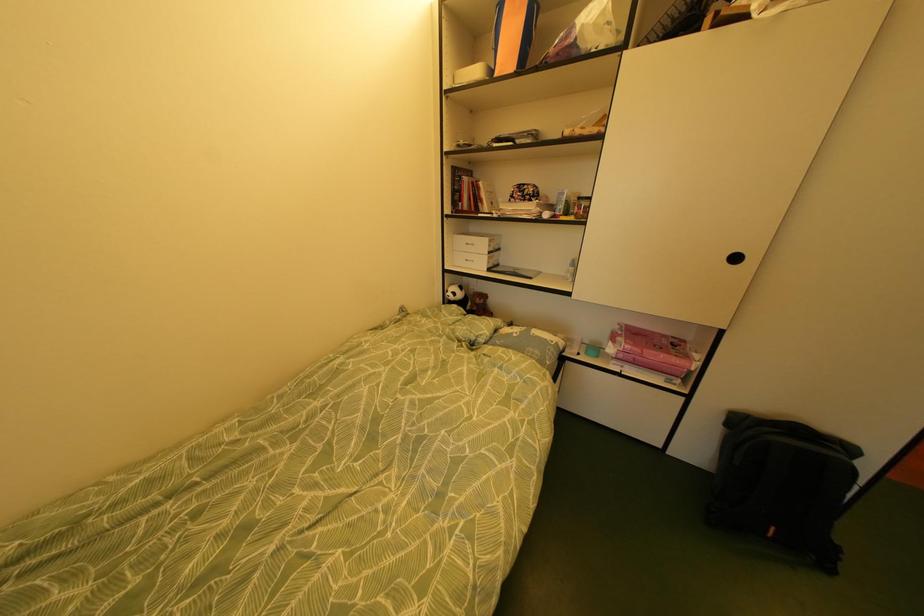
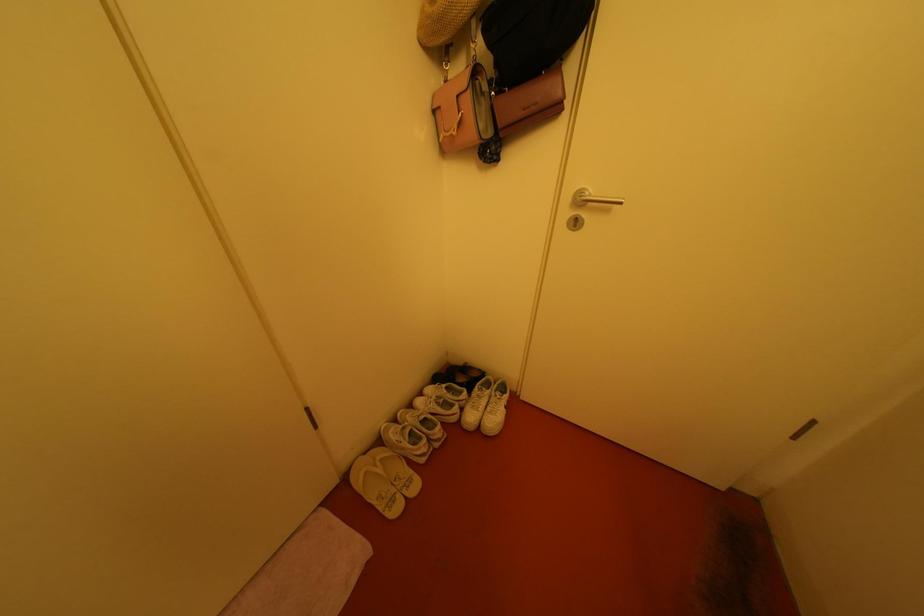
What movement of the cameraman would produce the second image?

The cameraman walked toward right, forward.